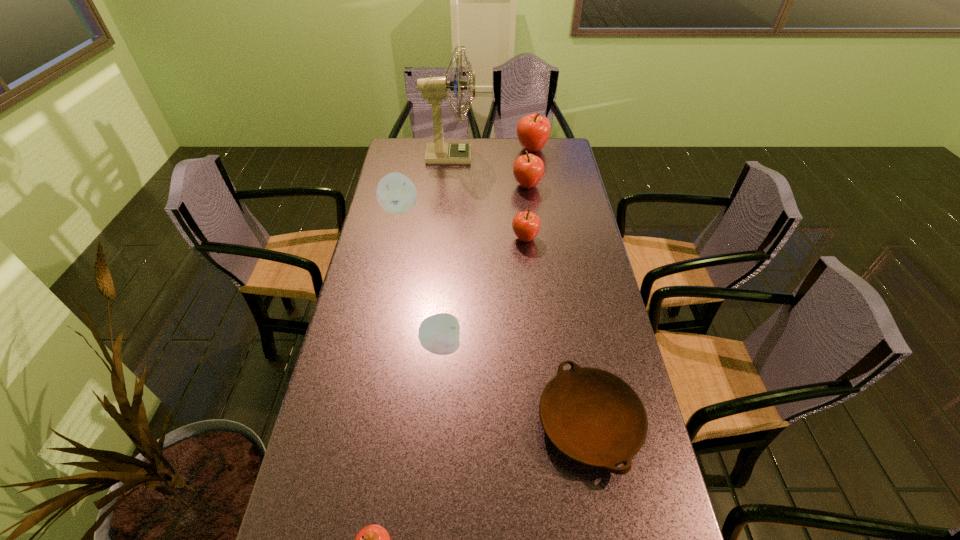
Choose which white apple is the second nearest neighbor to the fourth farthest apple. Please provide its 2D coordinates. Your answer should be formatted as a tuple, i.e. [(x, y)], where the tuple contains the x and y coordinates of a point satisfying the conditions above.

[(439, 334)]

Find the location of a particular element. Image resolution: width=960 pixels, height=540 pixels. the second closest white apple relative to the farthest pink apple is located at coordinates [x=439, y=334].

Find the location of a particular element. This screenshot has width=960, height=540. vacant position in the image that satisfies the following two spatial constraints: 1. on the front-facing side of the third farthest object; 2. on the right side of the fan is located at coordinates (447, 185).

The width and height of the screenshot is (960, 540). In order to click on vacant region that satisfies the following two spatial constraints: 1. on the front-facing side of the blue fan; 2. on the back side of the plate in this screenshot , I will do `click(427, 423)`.

Find the location of `vacant space that satisfies the following two spatial constraints: 1. on the front-facing side of the tallest object; 2. on the left side of the right white apple`. vacant space that satisfies the following two spatial constraints: 1. on the front-facing side of the tallest object; 2. on the left side of the right white apple is located at coordinates (434, 346).

Identify the location of vacant region that satisfies the following two spatial constraints: 1. on the front-facing side of the blue fan; 2. on the front side of the farther white apple. This screenshot has height=540, width=960. (445, 208).

This screenshot has height=540, width=960. I want to click on free space that satisfies the following two spatial constraints: 1. on the front side of the second nearest apple; 2. on the right side of the shortest object, so click(436, 423).

The height and width of the screenshot is (540, 960). In order to click on vacant position in the image that satisfies the following two spatial constraints: 1. on the front-facing side of the tallest object; 2. on the left side of the fourth apple from right to left in this screenshot , I will do `click(434, 346)`.

Locate an element on the screen. This screenshot has height=540, width=960. vacant space that satisfies the following two spatial constraints: 1. on the front-facing side of the fan; 2. on the left side of the second farthest pink apple is located at coordinates (447, 185).